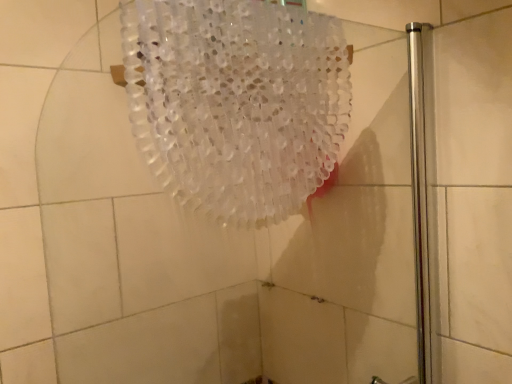
This screenshot has height=384, width=512. Describe the element at coordinates (236, 102) in the screenshot. I see `translucent plastic shower curtain at upper center` at that location.

At what (x,y) coordinates should I click in order to perform the action: click on translucent plastic shower curtain at upper center. Please return your answer as a coordinate pair (x, y). The height and width of the screenshot is (384, 512). Looking at the image, I should click on (236, 102).

Where is `translucent plastic shower curtain at upper center`? translucent plastic shower curtain at upper center is located at coordinates (236, 102).